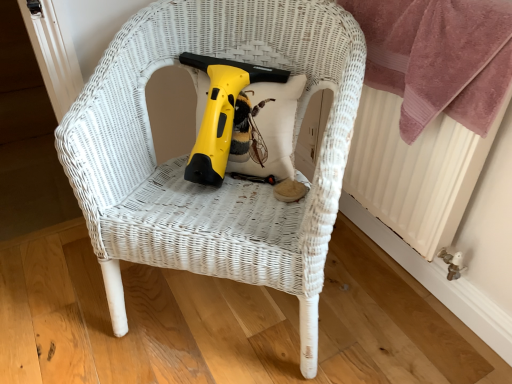
The height and width of the screenshot is (384, 512). What are the coordinates of `free spot above yellow plastic electric drill at center (from a real-world perspective)` in the screenshot? It's located at (227, 70).